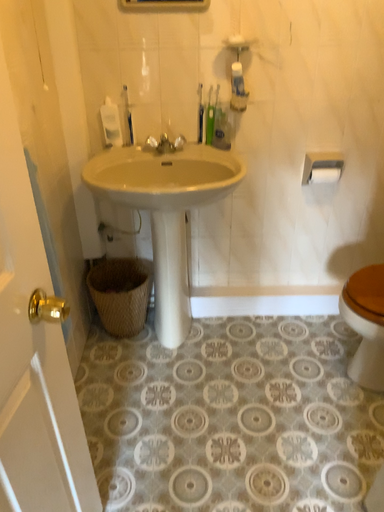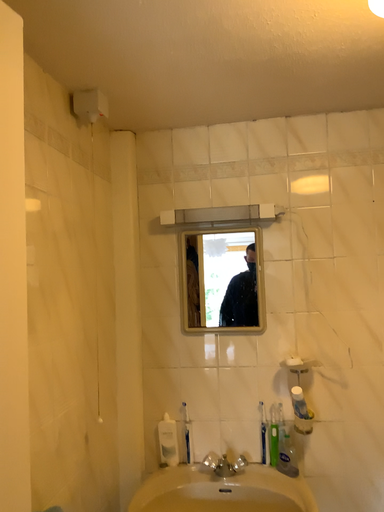
Question: Which way did the camera rotate in the video?

Choices:
 (A) rotated upward
 (B) rotated downward

Answer: (A)